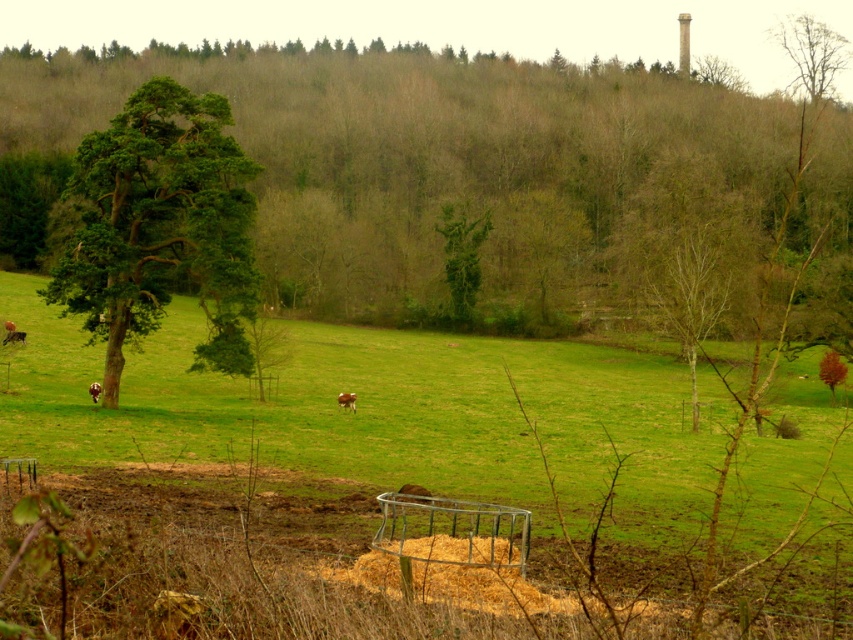
Which is in front, point (816, 54) or point (10, 336)?

Point (10, 336) is in front.

Which is more to the left, brown leafy tree at upper right or brown furry cow at lower left?

Positioned to the left is brown furry cow at lower left.

What do you see at coordinates (811, 54) in the screenshot? I see `brown leafy tree at upper right` at bounding box center [811, 54].

Where is `brown leafy tree at upper right`? brown leafy tree at upper right is located at coordinates (811, 54).

How far apart are smooth brown tree at right and brown furry cow at left?

smooth brown tree at right is 143.42 feet from brown furry cow at left.

Between point (834, 352) and point (96, 397), which one is positioned behind?

The point (834, 352) is behind.

The image size is (853, 640). Identify the location of smooth brown tree at right. (831, 369).

Measure the distance between smooth brown tree at right and camera.

smooth brown tree at right is 97.33 meters from camera.

Can you confirm if smooth brown tree at right is thinner than brown furry cow at center?

No, smooth brown tree at right is not thinner than brown furry cow at center.

Image resolution: width=853 pixels, height=640 pixels. I want to click on smooth brown tree at right, so click(x=831, y=369).